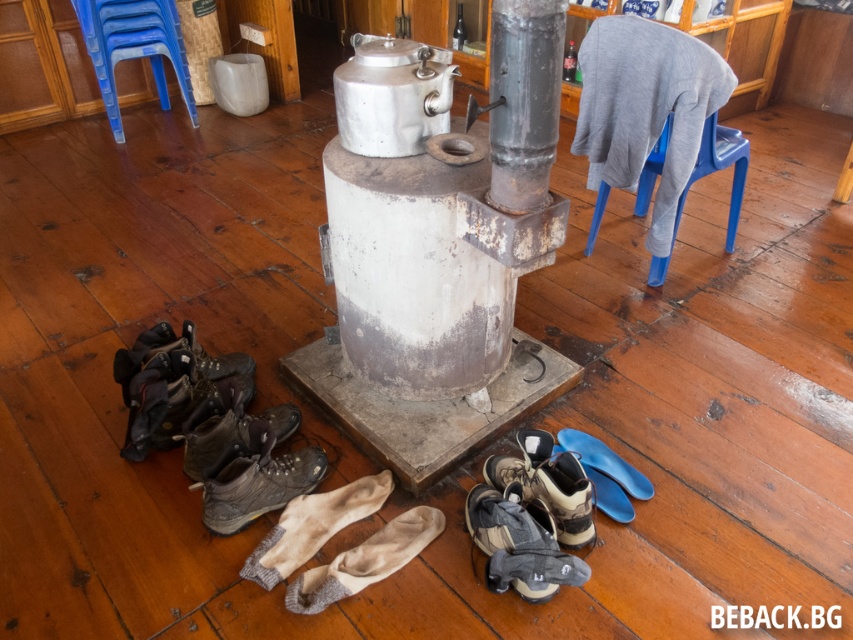
You are organizing the footwear in the rustic indoor setting. You need to place a new pair of boots between the leather hiking boot at lower left and the blue rubber shoe at lower center. Is there enough space between them to fit the new boots?

The leather hiking boot at lower left is positioned on the left side of blue rubber shoe at lower center. Since the new boots need to be placed between them, there is space available as the two existing items are already separated by some distance.

You are planning to place a rectangular box that is 1 meter wide between the metallic gray pillar at center and the blue plastic stool at upper left. Based on their widths, will the box fit between them?

The metallic gray pillar at center is narrower than the blue plastic stool at upper left, but the question is about the space between them, not their widths. The provided description only states their relative widths, not the distance between them. Therefore, we cannot determine if the box will fit based on the given information.